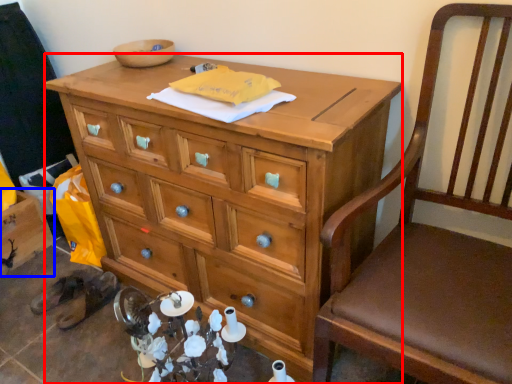
Question: Which point is closer to the camera, desk (highlighted by a red box) or cabinetry (highlighted by a blue box)?

Choices:
 (A) desk
 (B) cabinetry

Answer: (A)